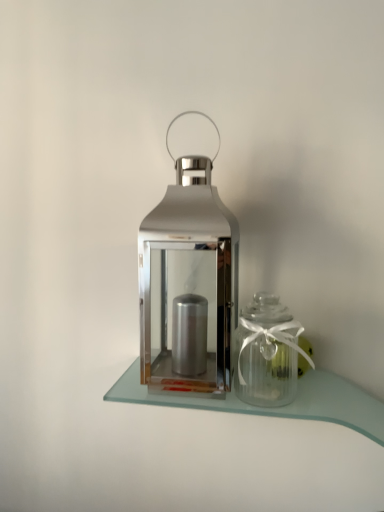
Question: From the image's perspective, is shiny metallic lantern at center located above clear glass table at center?

Choices:
 (A) yes
 (B) no

Answer: (A)

Question: Is shiny metallic lantern at center smaller than clear glass table at center?

Choices:
 (A) yes
 (B) no

Answer: (B)

Question: Is shiny metallic lantern at center at the right side of clear glass table at center?

Choices:
 (A) yes
 (B) no

Answer: (B)

Question: Is shiny metallic lantern at center aimed at clear glass table at center?

Choices:
 (A) yes
 (B) no

Answer: (B)

Question: Can you confirm if shiny metallic lantern at center is positioned to the left of clear glass table at center?

Choices:
 (A) no
 (B) yes

Answer: (B)

Question: Considering the relative sizes of shiny metallic lantern at center and clear glass table at center in the image provided, is shiny metallic lantern at center thinner than clear glass table at center?

Choices:
 (A) no
 (B) yes

Answer: (A)

Question: Is shiny metallic lantern at center not inside clear glass jar at right?

Choices:
 (A) no
 (B) yes

Answer: (B)

Question: Can you confirm if shiny metallic lantern at center is positioned to the right of clear glass jar at right?

Choices:
 (A) yes
 (B) no

Answer: (B)

Question: Does shiny metallic lantern at center turn towards clear glass jar at right?

Choices:
 (A) no
 (B) yes

Answer: (A)

Question: Is shiny metallic lantern at center smaller than clear glass jar at right?

Choices:
 (A) yes
 (B) no

Answer: (B)

Question: Can you confirm if shiny metallic lantern at center is bigger than clear glass jar at right?

Choices:
 (A) yes
 (B) no

Answer: (A)

Question: Is shiny metallic lantern at center looking in the opposite direction of clear glass jar at right?

Choices:
 (A) no
 (B) yes

Answer: (A)

Question: From the image's perspective, is clear glass jar at right under shiny metallic lantern at center?

Choices:
 (A) no
 (B) yes

Answer: (B)